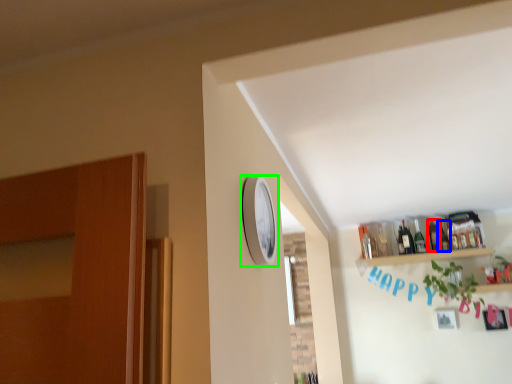
Question: Which object is the farthest from bottle (highlighted by a red box)? Choose among these: bottle (highlighted by a blue box) or clock (highlighted by a green box).

Choices:
 (A) bottle
 (B) clock

Answer: (B)